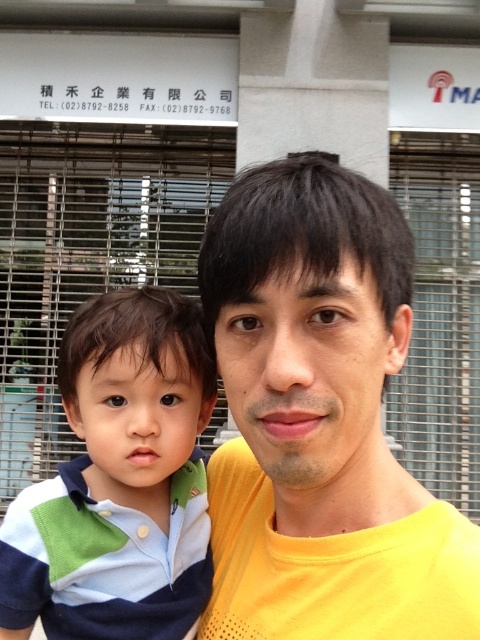
Question: Which of the following is the farthest from the observer?

Choices:
 (A) striped cotton shirt at left
 (B) yellow matte shirt at center

Answer: (A)

Question: In this image, where is yellow matte shirt at center located relative to striped cotton shirt at left?

Choices:
 (A) above
 (B) below

Answer: (A)

Question: Does yellow matte shirt at center appear on the left side of striped cotton shirt at left?

Choices:
 (A) no
 (B) yes

Answer: (A)

Question: Does yellow matte shirt at center have a smaller size compared to striped cotton shirt at left?

Choices:
 (A) yes
 (B) no

Answer: (B)